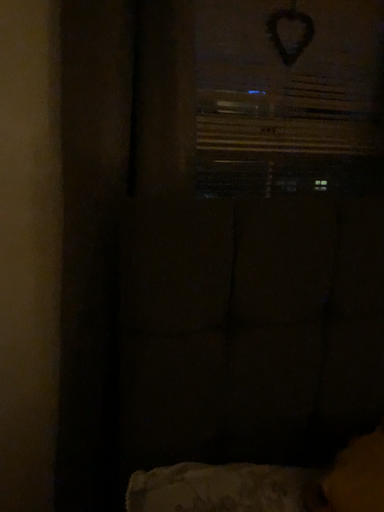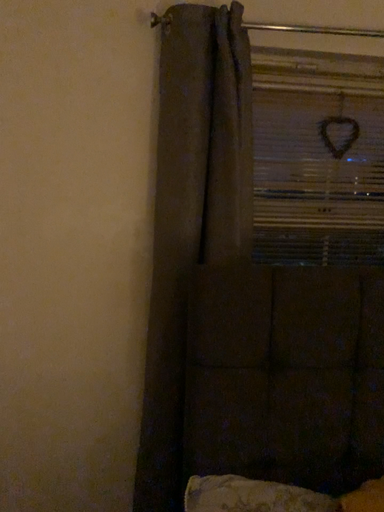
Question: Which way did the camera rotate in the video?

Choices:
 (A) rotated left
 (B) rotated right

Answer: (A)